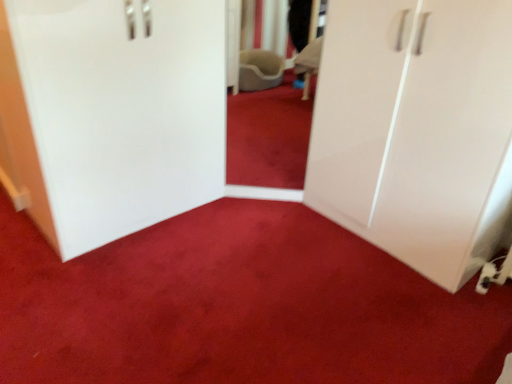
Where is `white glossy cupboard at right`? white glossy cupboard at right is located at coordinates (416, 130).

What do you see at coordinates (238, 306) in the screenshot? I see `matte white wardrobe at center` at bounding box center [238, 306].

Identify the location of white glossy cupboard at right. (416, 130).

Is white glossy cabinet at left to the right of matte white wardrobe at center from the viewer's perspective?

In fact, white glossy cabinet at left is to the left of matte white wardrobe at center.

Considering the sizes of white glossy cabinet at left and matte white wardrobe at center in the image, is white glossy cabinet at left wider or thinner than matte white wardrobe at center?

Considering their sizes, white glossy cabinet at left looks slimmer than matte white wardrobe at center.

From the image's perspective, which is below, white glossy cabinet at left or matte white wardrobe at center?

From the image's view, matte white wardrobe at center is below.

This screenshot has height=384, width=512. Identify the location of plain below the white glossy cabinet at left (from the image's perspective). pyautogui.click(x=238, y=306).

Which of these two, matte white wardrobe at center or white glossy cupboard at right, is bigger?

With larger size is white glossy cupboard at right.

Does matte white wardrobe at center have a lesser width compared to white glossy cupboard at right?

No, matte white wardrobe at center is not thinner than white glossy cupboard at right.

Identify the location of plain that appears in front of the white glossy cupboard at right. Image resolution: width=512 pixels, height=384 pixels. (238, 306).

From a real-world perspective, who is located lower, white glossy cupboard at right or matte white wardrobe at center?

matte white wardrobe at center, from a real-world perspective.

Would you say white glossy cupboard at right is a long distance from matte white wardrobe at center?

No, white glossy cupboard at right is in close proximity to matte white wardrobe at center.

Considering the relative sizes of white glossy cupboard at right and matte white wardrobe at center in the image provided, is white glossy cupboard at right smaller than matte white wardrobe at center?

No.

Which of these two, white glossy cupboard at right or matte white wardrobe at center, is thinner?

With smaller width is white glossy cupboard at right.

Is point (15, 140) closer or farther from the camera than point (486, 35)?

Clearly, point (15, 140) is more distant from the camera than point (486, 35).

Consider the image. Looking at their sizes, would you say white glossy cabinet at left is wider or thinner than white glossy cupboard at right?

Considering their sizes, white glossy cabinet at left looks slimmer than white glossy cupboard at right.

Considering the sizes of objects white glossy cabinet at left and white glossy cupboard at right in the image provided, who is bigger, white glossy cabinet at left or white glossy cupboard at right?

white glossy cupboard at right is bigger.

Can you see white glossy cupboard at right touching white glossy cabinet at left?

white glossy cupboard at right is not next to white glossy cabinet at left, and they're not touching.

Is white glossy cupboard at right bigger than white glossy cabinet at left?

Yes.

Can you confirm if white glossy cupboard at right is shorter than white glossy cabinet at left?

In fact, white glossy cupboard at right may be taller than white glossy cabinet at left.

From the image's perspective, would you say white glossy cupboard at right is positioned over white glossy cabinet at left?

No, from the image's perspective, white glossy cupboard at right is not above white glossy cabinet at left.

From a real-world perspective, which is physically below, matte white wardrobe at center or white glossy cabinet at left?

From a 3D spatial view, matte white wardrobe at center is below.

Is matte white wardrobe at center wider or thinner than white glossy cabinet at left?

Clearly, matte white wardrobe at center has more width compared to white glossy cabinet at left.

From the image's perspective, is matte white wardrobe at center below white glossy cabinet at left?

Yes, from the image's perspective, matte white wardrobe at center is beneath white glossy cabinet at left.

Could you tell me if matte white wardrobe at center is facing white glossy cabinet at left?

Yes, matte white wardrobe at center is oriented towards white glossy cabinet at left.

I want to click on plain below the white glossy cabinet at left (from the image's perspective), so click(238, 306).

Image resolution: width=512 pixels, height=384 pixels. In order to click on plain in front of the white glossy cupboard at right in this screenshot , I will do `click(238, 306)`.

Considering their positions, is white glossy cupboard at right positioned closer to matte white wardrobe at center than white glossy cabinet at left?

Among the two, white glossy cupboard at right is located nearer to matte white wardrobe at center.

Based on their spatial positions, is matte white wardrobe at center or white glossy cupboard at right further from white glossy cabinet at left?

Based on the image, white glossy cupboard at right appears to be further to white glossy cabinet at left.

From the image, which object appears to be farther from white glossy cupboard at right, white glossy cabinet at left or matte white wardrobe at center?

The object further to white glossy cupboard at right is white glossy cabinet at left.

Looking at this image, based on their spatial positions, is white glossy cabinet at left or white glossy cupboard at right closer to matte white wardrobe at center?

Among the two, white glossy cupboard at right is located nearer to matte white wardrobe at center.

Looking at the image, which one is located further to white glossy cupboard at right, matte white wardrobe at center or white glossy cabinet at left?

Based on the image, white glossy cabinet at left appears to be further to white glossy cupboard at right.

Which object lies nearer to the anchor point white glossy cabinet at left, white glossy cupboard at right or matte white wardrobe at center?

Among the two, matte white wardrobe at center is located nearer to white glossy cabinet at left.

This screenshot has width=512, height=384. In order to click on plain located between white glossy cabinet at left and white glossy cupboard at right in the left-right direction in this screenshot , I will do `click(238, 306)`.